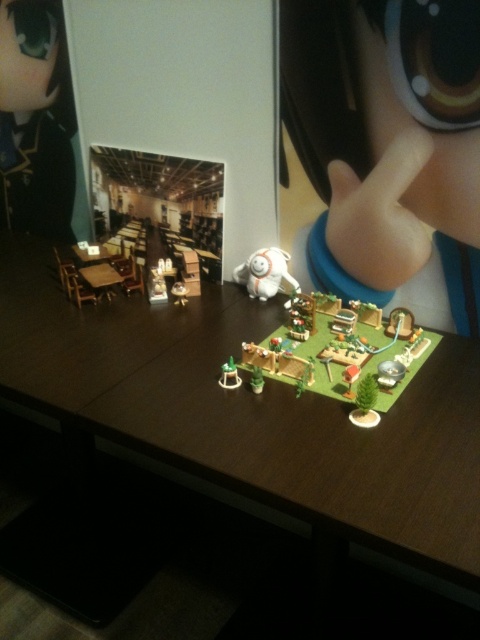
Between green matte playset at center and wooden table at center, which one appears on the left side from the viewer's perspective?

wooden table at center is more to the left.

Which is in front, point (435, 512) or point (92, 259)?

Positioned in front is point (435, 512).

Who is more forward, (173, 445) or (96, 259)?

Positioned in front is point (173, 445).

I want to click on green matte playset at center, so click(x=298, y=432).

Who is shorter, wooden table at left or green matte toy at center?

green matte toy at center

Can you confirm if wooden table at left is bigger than green matte toy at center?

Indeed, wooden table at left has a larger size compared to green matte toy at center.

Identify the location of wooden table at left. (100, 278).

At what (x,y) coordinates should I click in order to perform the action: click on wooden table at left. Please return your answer as a coordinate pair (x, y). The width and height of the screenshot is (480, 640). Looking at the image, I should click on (100, 278).

Does point (275, 266) come closer to viewer compared to point (109, 282)?

Yes, it is.

Who is more distant from viewer, (x=237, y=266) or (x=90, y=273)?

The point (x=237, y=266) is behind.

Is point (294, 282) closer to camera compared to point (94, 276)?

Yes, point (294, 282) is in front of point (94, 276).

The height and width of the screenshot is (640, 480). In order to click on white plush toy at center in this screenshot , I will do `click(264, 273)`.